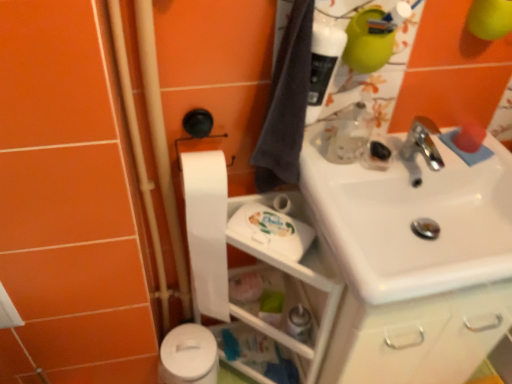
This screenshot has height=384, width=512. What are the coordinates of `vacant space situated above white plastic shelf at lower center (from a real-world perspective)` in the screenshot? It's located at (254, 227).